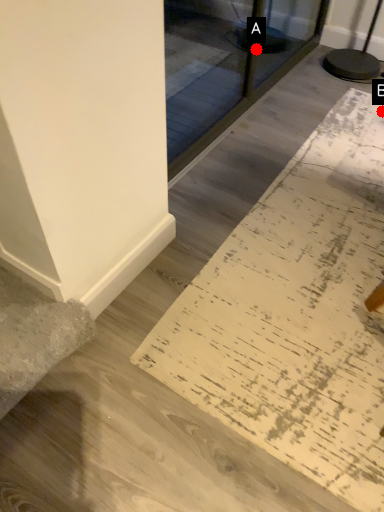
Question: Two points are circled on the image, labeled by A and B beside each circle. Which point is farther from the camera taking this photo?

Choices:
 (A) A is further
 (B) B is further

Answer: (A)